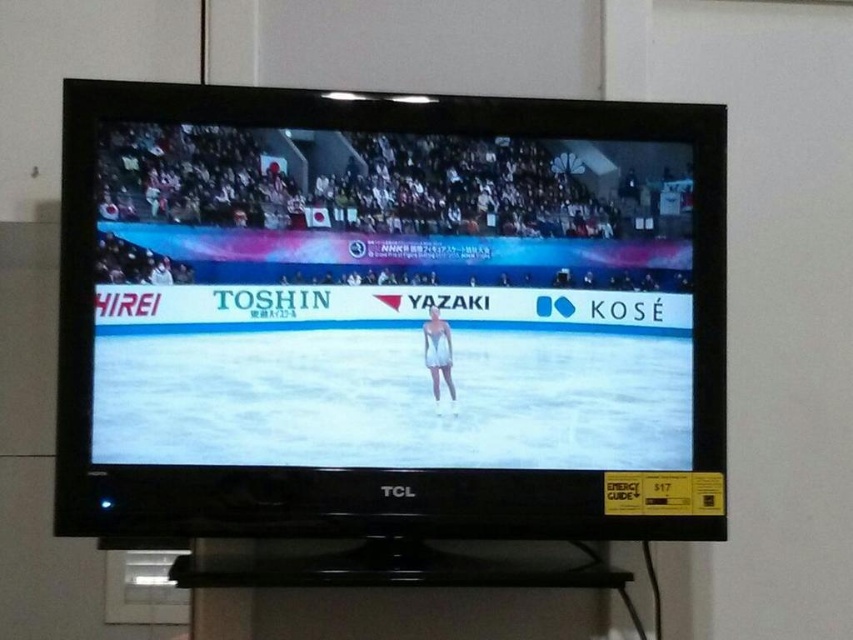
Based on the photo, can you confirm if matte white figure skater at center is wider than white matte swimsuit at center?

Correct, the width of matte white figure skater at center exceeds that of white matte swimsuit at center.

How far apart are matte white figure skater at center and white matte swimsuit at center?

matte white figure skater at center is 17.69 centimeters away from white matte swimsuit at center.

Where is `matte white figure skater at center`? matte white figure skater at center is located at coordinates coord(390,300).

This screenshot has width=853, height=640. Identify the location of matte white figure skater at center. (390, 300).